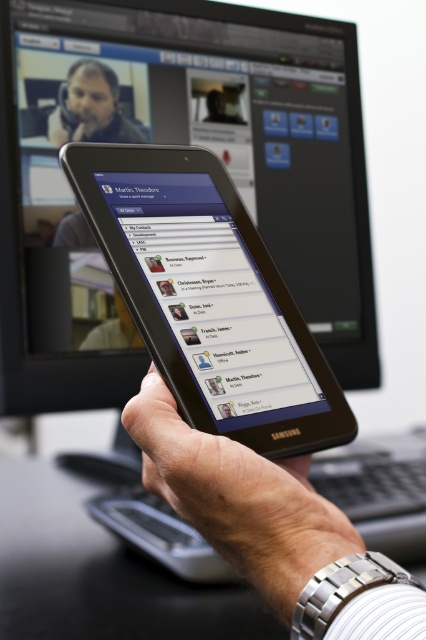
You are setting up a conference room and need to place the black glossy monitor at upper center. According to the image, where should you position it relative to the other objects in the scene?

The black glossy monitor at upper center should be positioned at point 0.223 on the x axis and 0.411 on the y axis as per the coordinate system provided in the description.

You are setting up a video call and need to position your black glossy monitor at upper center so that the camera can capture both the monitor and yourself clearly. Given that the camera has a 90 degree field of view, can the camera capture both the monitor and yourself if you are standing 25.86 inches away from the monitor?

The black glossy monitor at upper center and camera are 25.86 inches apart from each other. Since the camera has a 90 degree field of view, standing 25.86 inches away from the monitor would allow the camera to capture both the monitor and yourself within the field of view.

You are setting up a video call and need to adjust the black glossy monitor at upper center and the black matte tablet at center. Which device should you move to the right to align them properly?

The black glossy monitor at upper center is to the left of black matte tablet at center, so you should move the black glossy monitor at upper center to the right to align them properly.